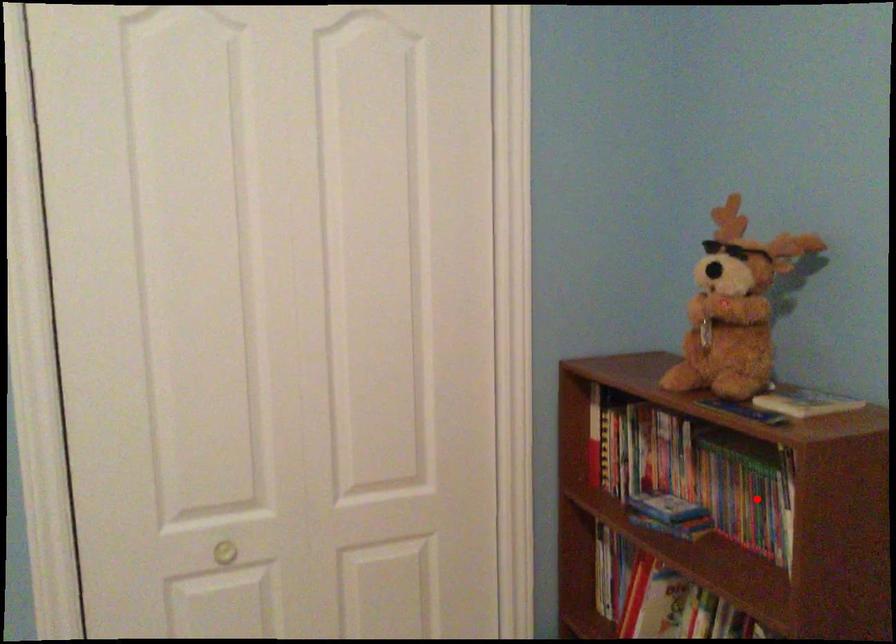
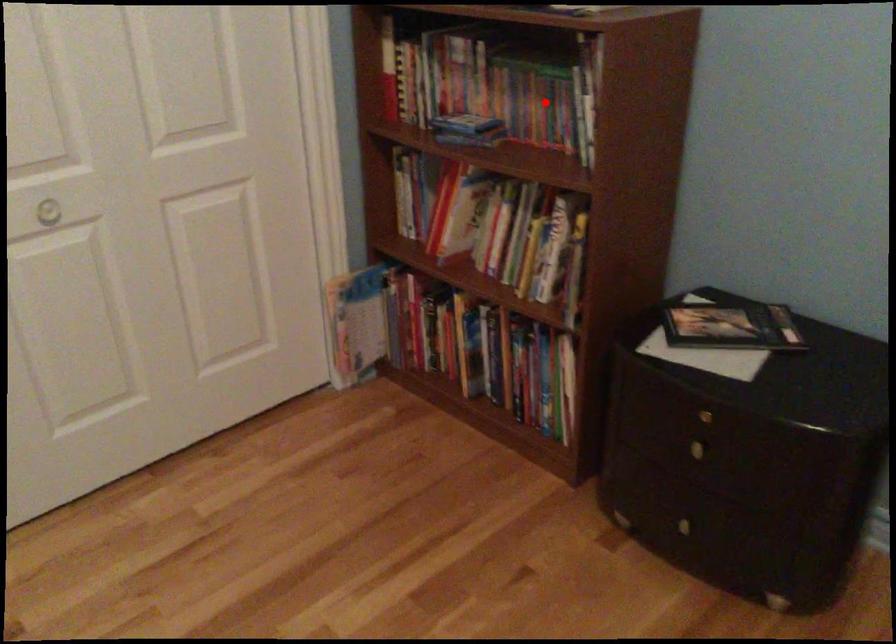
I am providing you with two images of the same scene from different viewpoints. A red point is marked on the first image and another point is marked on the second image. Is the marked point in image1 the same physical position as the marked point in image2?

Yes